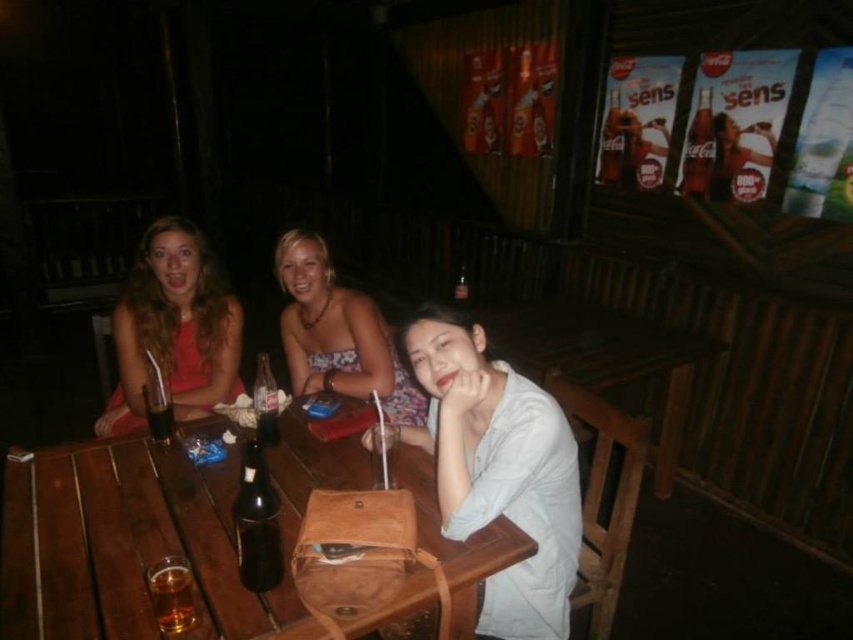
Looking at this image, you are a server at the rustic outdoor bar. You need to deliver a drink to the guest wearing the matte red dress at left. The black glass bottle at center contains the drink. Can you reach the guest without moving the bottle?

The distance between the matte red dress at left and the black glass bottle at center is 38.59 inches, so yes, you can reach the guest wearing the matte red dress at left without moving the black glass bottle at center as the distance is manageable for a server to pour or hand the drink.